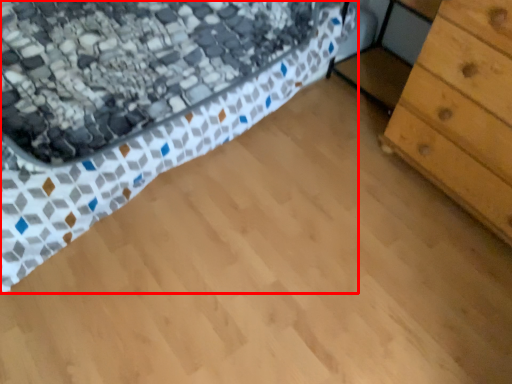
Question: From the image's perspective, considering the relative positions of bed (annotated by the red box) and chest of drawers in the image provided, where is bed (annotated by the red box) located with respect to the staircase?

Choices:
 (A) below
 (B) above

Answer: (B)